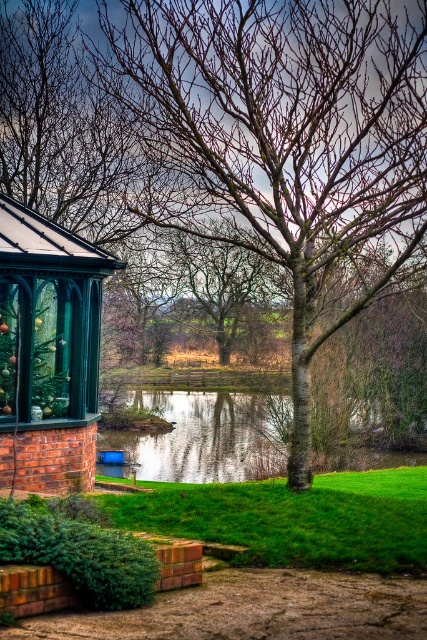
You are planning to install a new lighting system for the garden. The matte green gazebo at left requires a taller light post than the reflective glass water at center. Based on the scene description, is the current setup suitable for this requirement?

The matte green gazebo at left is much taller than the reflective glass water at center, so the current setup is suitable because the gazebo requires a taller light post which matches its height.

You are standing in the garden and want to take a photo of the smooth bark tree at center. If your camera has a maximum focus range of 7 meters, will it be able to capture the tree clearly?

The smooth bark tree at center is 7.84 meters away from the camera. Since the camera can only focus up to 7 meters, it will not be able to capture the tree clearly.

You are planning to place a new bench in the garden. The bench requires a space that is wider than the matte green gazebo at left. Can the area near the smooth bark tree at center accommodate it?

The smooth bark tree at center is larger in size than the matte green gazebo at left, so the area near the smooth bark tree at center likely has enough space to accommodate the bench requiring a wider space than the matte green gazebo at left.